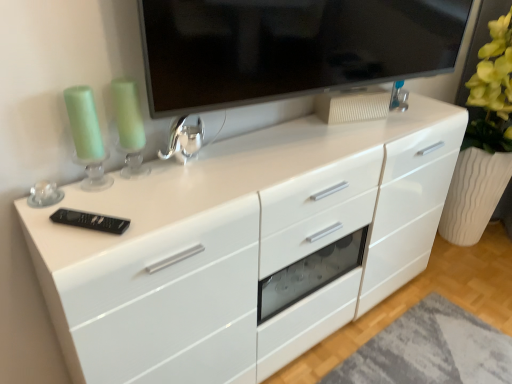
At what (x,y) coordinates should I click in order to perform the action: click on vacant position to the left of black plastic remote at lower left, which appears as the 2th appliance when viewed from the right. Please return your answer as a coordinate pair (x, y). This screenshot has height=384, width=512. Looking at the image, I should click on (47, 225).